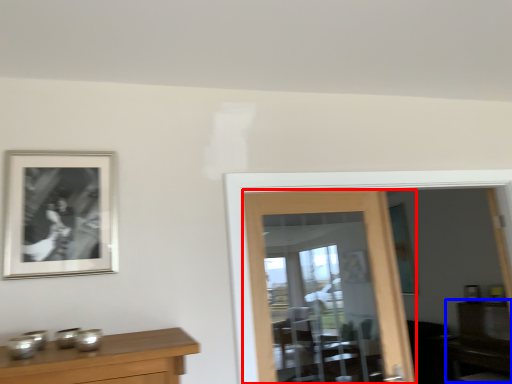
Question: Among these objects, which one is farthest to the camera, door (highlighted by a red box) or dresser (highlighted by a blue box)?

Choices:
 (A) door
 (B) dresser

Answer: (B)